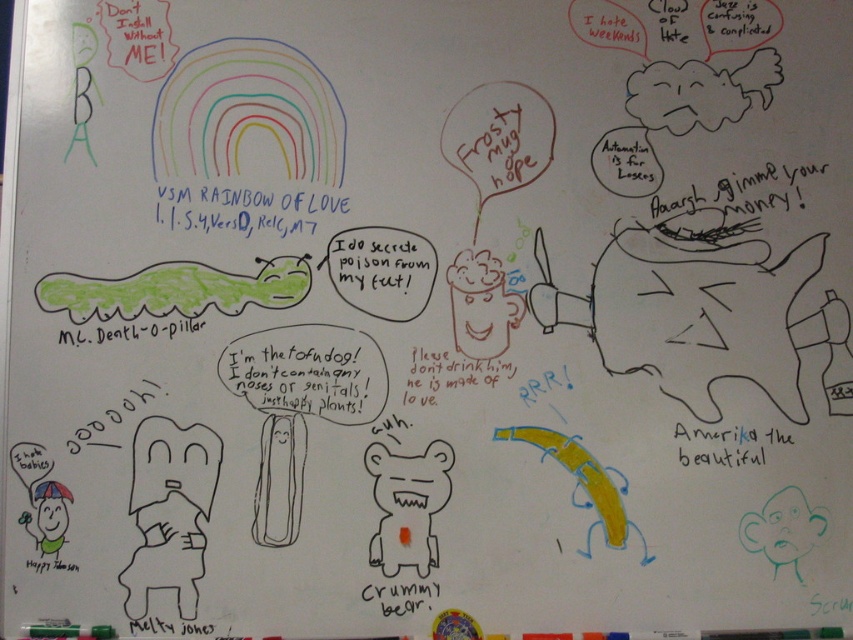
In the scene shown: Who is positioned more to the left, black marker text at upper center or black paper at lower right?

black marker text at upper center

Which is in front, point (316, 204) or point (770, 428)?

Positioned in front is point (316, 204).

You are a GUI agent. You are given a task and a screenshot of the screen. Output one action in this format:
    pyautogui.click(x=<x>, y=<y>)
    Task: Click on the black marker text at upper center
    The height and width of the screenshot is (640, 853).
    Given the screenshot: What is the action you would take?
    pyautogui.click(x=247, y=209)

At what (x,y) coordinates should I click in order to perform the action: click on black marker text at upper center. Please return your answer as a coordinate pair (x, y). Looking at the image, I should click on (247, 209).